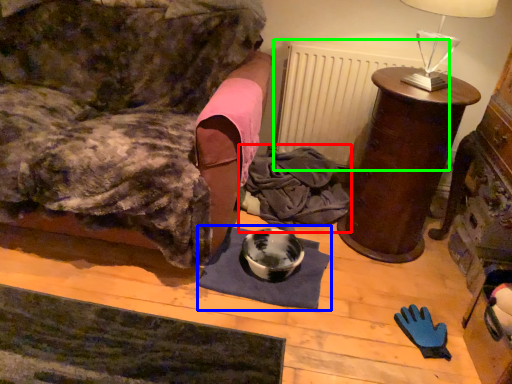
Question: Estimate the real-world distances between objects in this image. Which object is closer to clothing (highlighted by a red box), mat (highlighted by a blue box) or radiator (highlighted by a green box)?

Choices:
 (A) mat
 (B) radiator

Answer: (B)